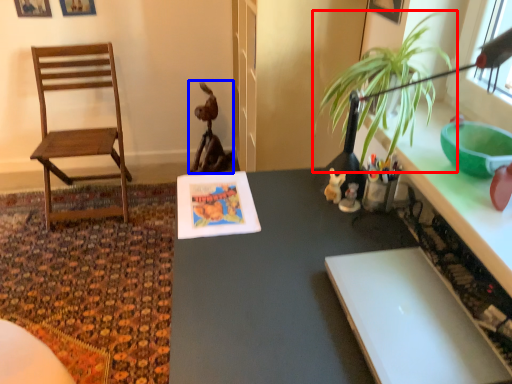
Question: Which of the following is the farthest to the observer, houseplant (highlighted by a red box) or animal (highlighted by a blue box)?

Choices:
 (A) houseplant
 (B) animal

Answer: (B)